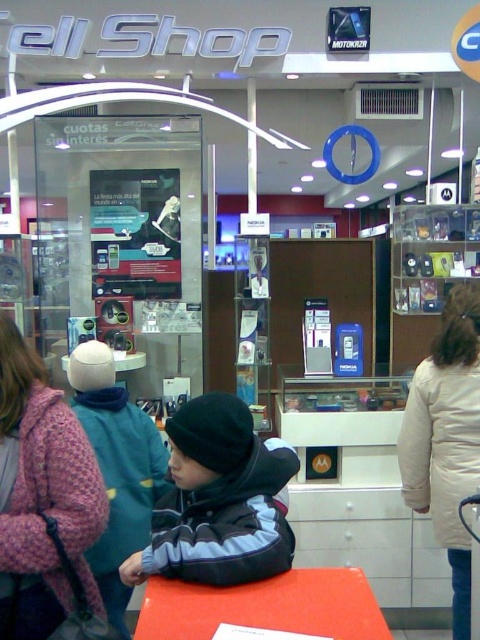
Question: Is gray fleece jacket at center to the right of white wool coat at right from the viewer's perspective?

Choices:
 (A) yes
 (B) no

Answer: (B)

Question: Is gray fleece jacket at center smaller than white wool coat at right?

Choices:
 (A) no
 (B) yes

Answer: (B)

Question: Which point is farther to the camera?

Choices:
 (A) smooth orange table at center
 (B) green fuzzy jacket at center
 (C) knitted pink sweater at left
 (D) white wool coat at right

Answer: (D)

Question: Where is green fuzzy jacket at center located in relation to smooth orange table at center in the image?

Choices:
 (A) below
 (B) above

Answer: (B)

Question: Which object is positioned closest to the smooth orange table at center?

Choices:
 (A) green fuzzy jacket at center
 (B) gray fleece jacket at center
 (C) white wool coat at right

Answer: (B)

Question: Which of these objects is positioned farthest from the knitted pink sweater at left?

Choices:
 (A) smooth orange table at center
 (B) white wool coat at right
 (C) green fuzzy jacket at center

Answer: (B)